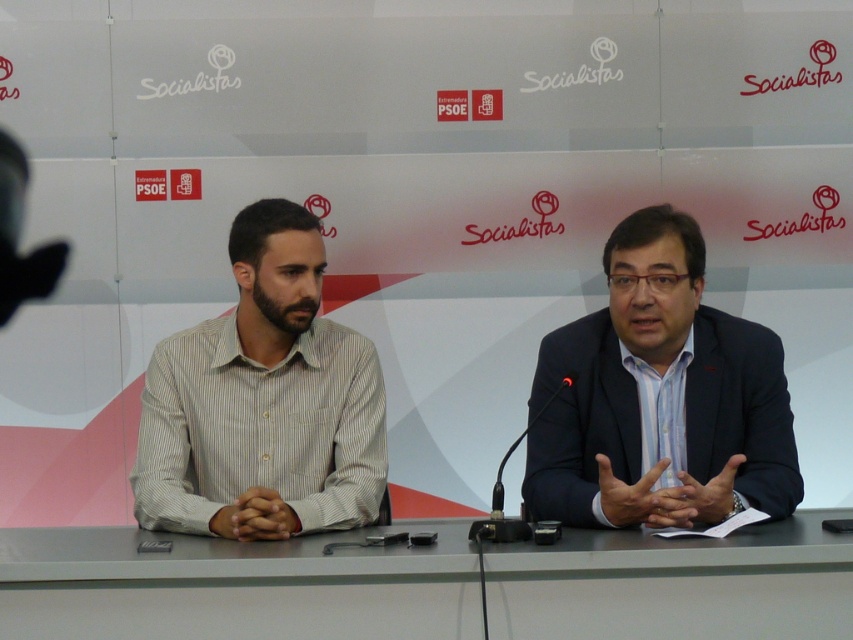
Who is taller, blue striped shirt at center or striped cotton shirt at left?

striped cotton shirt at left

Between point (767, 392) and point (370, 454), which one is positioned in front?

Positioned in front is point (767, 392).

Where is `blue striped shirt at center`? This screenshot has width=853, height=640. blue striped shirt at center is located at coordinates (659, 397).

Is gray/matte table at center to the right of blue striped shirt at center from the viewer's perspective?

Incorrect, gray/matte table at center is not on the right side of blue striped shirt at center.

Between gray/matte table at center and blue striped shirt at center, which one is positioned higher?

blue striped shirt at center is above.

Is point (503, 598) positioned in front of point (753, 444)?

Yes, it is.

Where is `gray/matte table at center`? The height and width of the screenshot is (640, 853). gray/matte table at center is located at coordinates (233, 586).

Is gray/matte table at center shorter than striped cotton shirt at left?

Yes.

Who is positioned more to the left, gray/matte table at center or striped cotton shirt at left?

Positioned to the left is striped cotton shirt at left.

Does point (509, 573) come closer to viewer compared to point (216, 461)?

That is True.

At what (x,y) coordinates should I click in order to perform the action: click on gray/matte table at center. Please return your answer as a coordinate pair (x, y). Image resolution: width=853 pixels, height=640 pixels. Looking at the image, I should click on (233, 586).